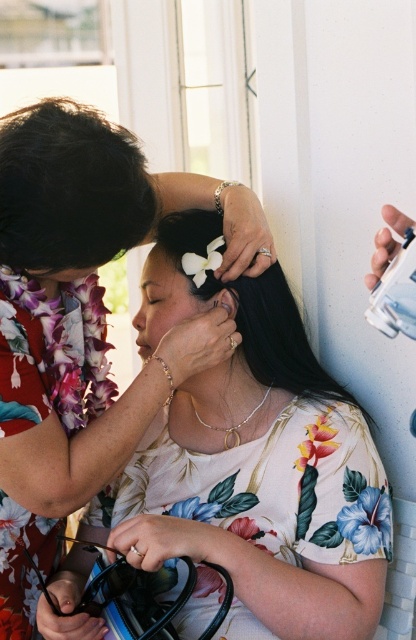
Between floral fabric at center and black silky hair at center, which one has more height?

floral fabric at center is taller.

Can you confirm if floral fabric at center is taller than black silky hair at center?

Indeed, floral fabric at center has a greater height compared to black silky hair at center.

Is point (84, 358) farther from camera compared to point (292, 296)?

No, it is not.

Find the location of a particular element. The image size is (416, 640). floral fabric at center is located at coordinates (84, 321).

Can you confirm if black silky hair at upper left is positioned to the right of black silky hair at center?

No, black silky hair at upper left is not to the right of black silky hair at center.

Who is positioned more to the right, black silky hair at upper left or black silky hair at center?

From the viewer's perspective, black silky hair at center appears more on the right side.

Which is behind, point (131, 148) or point (166, 241)?

Point (166, 241)

You are a GUI agent. You are given a task and a screenshot of the screen. Output one action in this format:
    pyautogui.click(x=<x>, y=<y>)
    Task: Click on the black silky hair at upper left
    
    Given the screenshot: What is the action you would take?
    pyautogui.click(x=69, y=188)

Can you confirm if floral fabric at center is smaller than black silky hair at upper left?

Actually, floral fabric at center might be larger than black silky hair at upper left.

Who is more distant from viewer, (198, 348) or (76, 243)?

The point (198, 348) is behind.

Which is in front, point (44, 323) or point (136, 192)?

Positioned in front is point (136, 192).

The height and width of the screenshot is (640, 416). I want to click on floral fabric at center, so click(x=84, y=321).